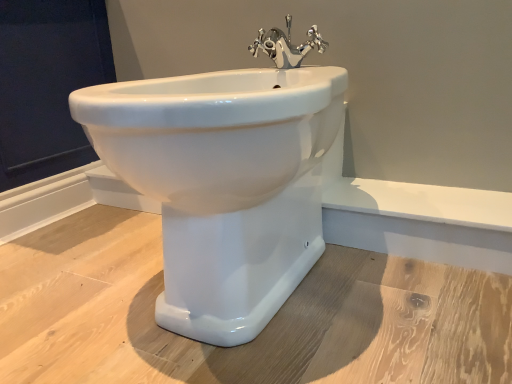
Locate an element on the screen. free spot to the left of white glossy bidet at center is located at coordinates (79, 279).